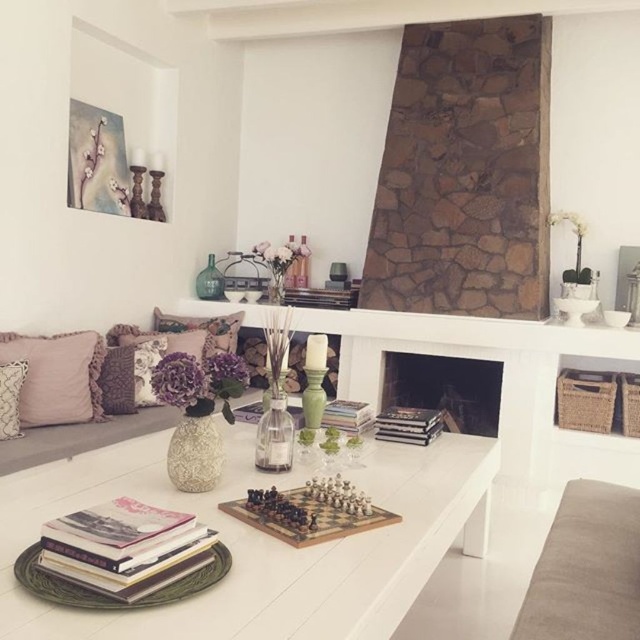
Does point (369, 508) lie in front of point (212, 323)?

Yes, it is.

In the scene shown: Does wooden chess set at center come behind velvet floral pillow at center?

No, it is in front of velvet floral pillow at center.

The height and width of the screenshot is (640, 640). Identify the location of wooden chess set at center. tap(305, 515).

Measure the distance between point [76,486] and camera.

Point [76,486] is 6.19 feet from camera.

Between point (403, 548) and point (157, 320), which one is positioned behind?

The point (157, 320) is behind.

At what (x,y) coordinates should I click in order to perform the action: click on white glossy coffee table at center. Please return your answer as a coordinate pair (x, y). Looking at the image, I should click on pyautogui.click(x=259, y=540).

This screenshot has width=640, height=640. I want to click on white glossy coffee table at center, so click(259, 540).

Does pale pink fabric cushion at left appear on the right side of velvet floral pillow at center?

Incorrect, pale pink fabric cushion at left is not on the right side of velvet floral pillow at center.

Between pale pink fabric cushion at left and velvet floral pillow at center, which one has less height?

velvet floral pillow at center

Is point (36, 390) farther from viewer compared to point (196, 324)?

No, it is not.

You are a GUI agent. You are given a task and a screenshot of the screen. Output one action in this format:
    pyautogui.click(x=<x>, y=<y>)
    Task: Click on the pale pink fabric cushion at left
    
    Given the screenshot: What is the action you would take?
    pyautogui.click(x=56, y=376)